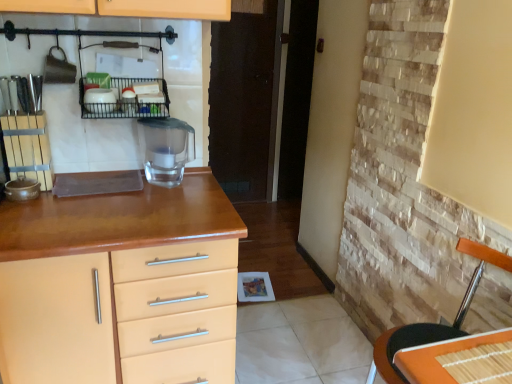
I want to click on vacant area that is in front of transparent glass water filter at center, so coord(156,201).